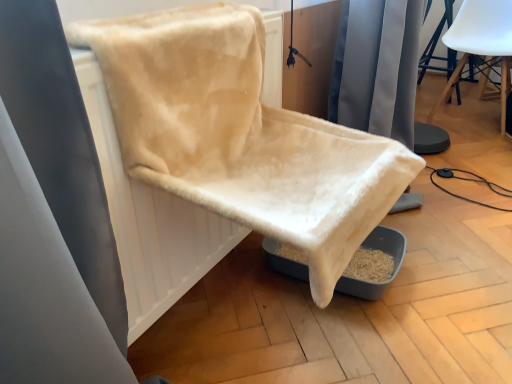
Question: Relative to white matte chair at upper right, which is the 1th chair in right-to-left order, is beige fabric radiator at center in front or behind?

Choices:
 (A) front
 (B) behind

Answer: (A)

Question: Is point (198, 271) positioned closer to the camera than point (487, 51)?

Choices:
 (A) closer
 (B) farther

Answer: (A)

Question: Estimate the real-world distances between objects in this image. Which object is closer to the beige fabric radiator at center?

Choices:
 (A) white matte chair at upper right, which is counted as the second chair, starting from the front
 (B) beige plush chair at center, the first chair viewed from the front

Answer: (B)

Question: Which is farther from the beige plush chair at center, which ranks as the 2th chair in top-to-bottom order?

Choices:
 (A) beige fabric radiator at center
 (B) white matte chair at upper right, acting as the first chair starting from the back

Answer: (B)